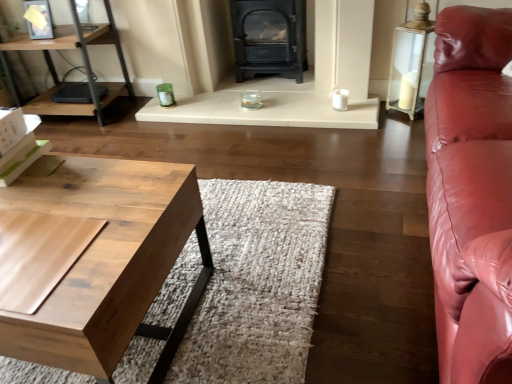
Where is `free space in front of black cast iron fireplace at center`? free space in front of black cast iron fireplace at center is located at coordinates (293, 155).